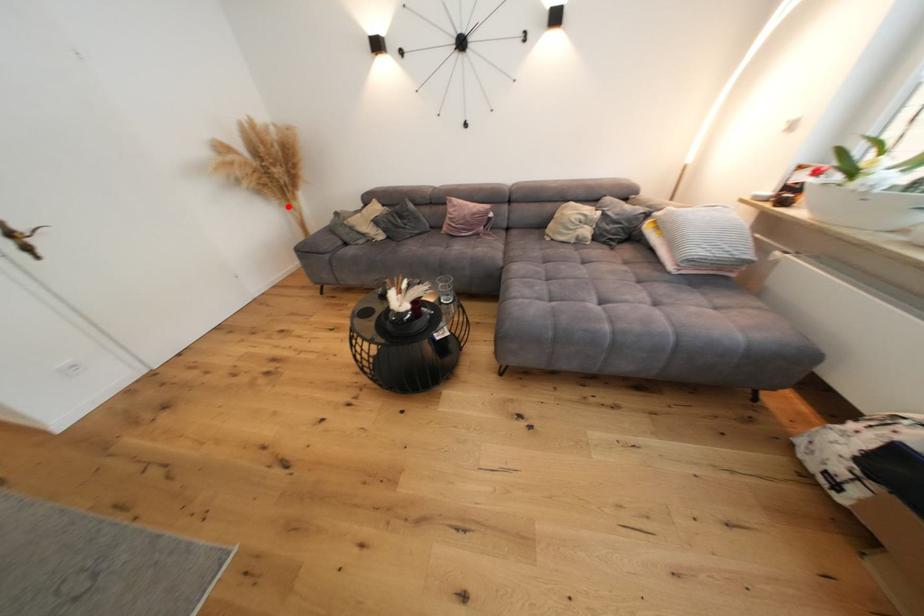
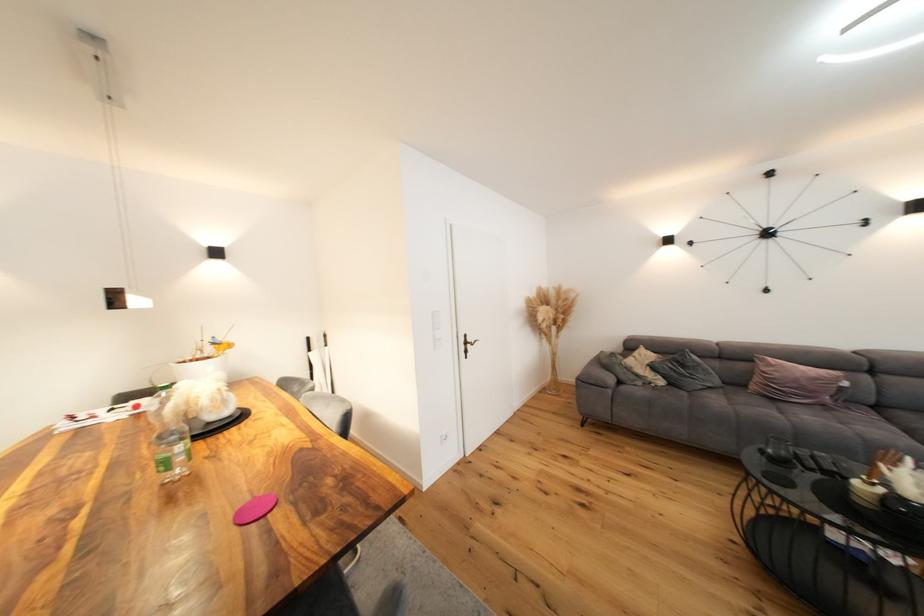
Question: I am providing you with two images of the same scene from different viewpoints. Given a red point in image1, look at the same physical point in image2. Is it:

Choices:
 (A) Closer to the viewpoint
 (B) Farther from the viewpoint

Answer: (B)